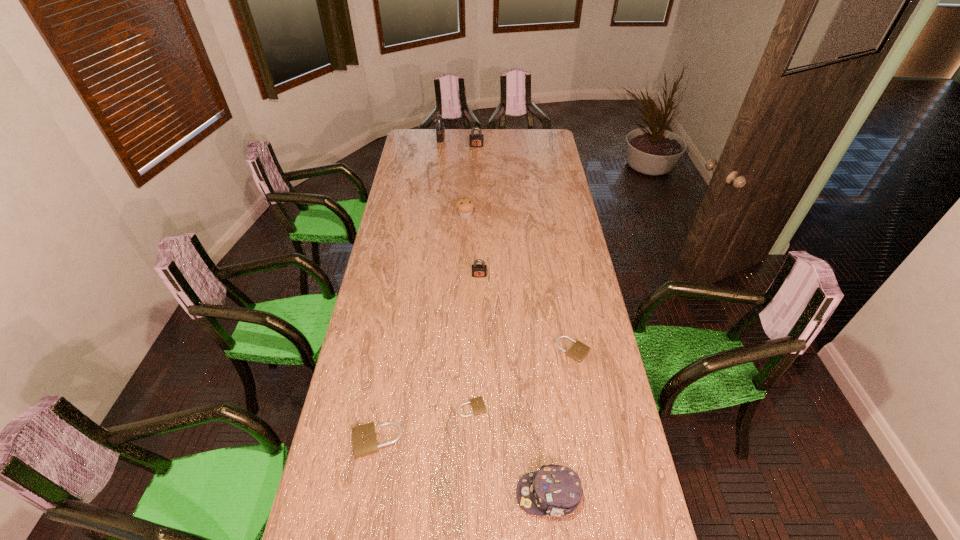
Identify the location of free space between the nearest padlock and the headwear. (463, 467).

At what (x,y) coordinates should I click in order to perform the action: click on unoccupied position between the second biggest gray padlock and the headwear. Please return your answer as a coordinate pair (x, y). Looking at the image, I should click on (513, 320).

Image resolution: width=960 pixels, height=540 pixels. I want to click on vacant space that is in between the second beige padlock from right to left and the second biggest beige padlock, so click(523, 379).

Find the location of `blank region between the second farthest gray padlock and the nearest beige padlock`. blank region between the second farthest gray padlock and the nearest beige padlock is located at coordinates (426, 293).

Locate an element on the screen. The image size is (960, 540). free spot between the fifth farthest object and the shortest object is located at coordinates (523, 379).

At what (x,y) coordinates should I click in order to perform the action: click on free space between the biggest beige padlock and the shortest object. Please return your answer as a coordinate pair (x, y). Looking at the image, I should click on (424, 424).

Find the location of a particular element. unoccupied position between the nearest beige padlock and the seventh nearest object is located at coordinates click(x=426, y=293).

The height and width of the screenshot is (540, 960). Identify the location of vacant area between the farthest padlock and the second nearest object. (409, 289).

Where is `free point between the smallest gray padlock and the headwear`? free point between the smallest gray padlock and the headwear is located at coordinates click(514, 385).

Select which object appears as the fourth closest to the third shortest object. Please provide its 2D coordinates. Your answer should be formatted as a tuple, i.e. [(x, y)], where the tuple contains the x and y coordinates of a point satisfying the conditions above.

[(478, 270)]